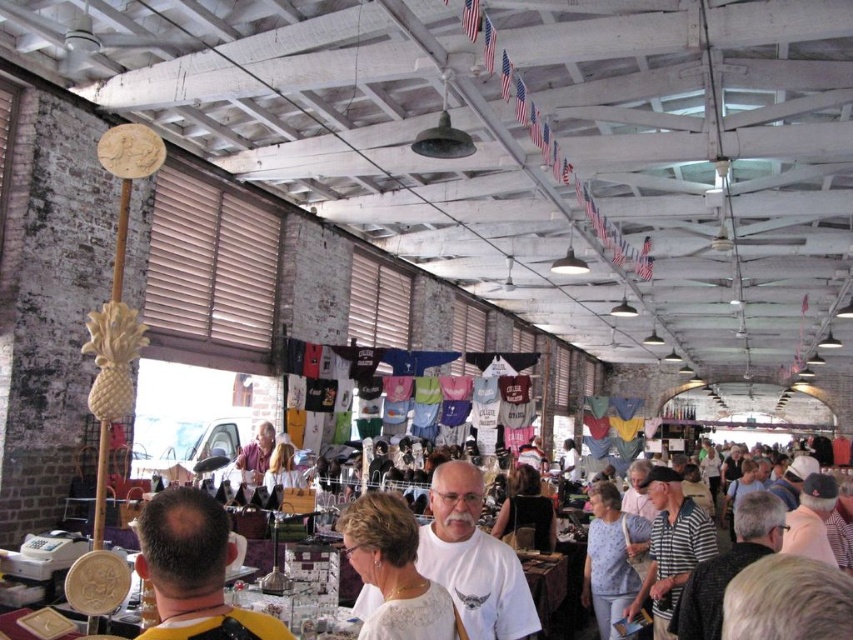
Question: Which of the following is the closest to the observer?

Choices:
 (A) pos(772,552)
 (B) pos(434,474)
 (C) pos(190,554)

Answer: (C)

Question: Does dark brown leather jacket at center have a lesser width compared to striped cotton shirt at center?

Choices:
 (A) no
 (B) yes

Answer: (B)

Question: Can you confirm if dark brown leather jacket at center is positioned to the right of white matte t-shirt at center?

Choices:
 (A) no
 (B) yes

Answer: (A)

Question: Which object is farther from the camera taking this photo?

Choices:
 (A) striped cotton shirt at center
 (B) white matte t-shirt at center

Answer: (A)

Question: Does white matte t-shirt at center appear on the right side of striped cotton shirt at center?

Choices:
 (A) yes
 (B) no

Answer: (B)

Question: Among these points, which one is nearest to the camera?

Choices:
 (A) click(x=218, y=605)
 (B) click(x=746, y=516)

Answer: (A)